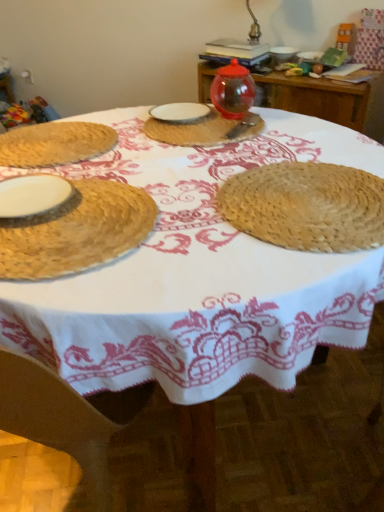
I want to click on free space that is in between woven straw placemat at left, which is counted as the first table, starting from the bottom, and matte wicker placemat at center, so click(134, 141).